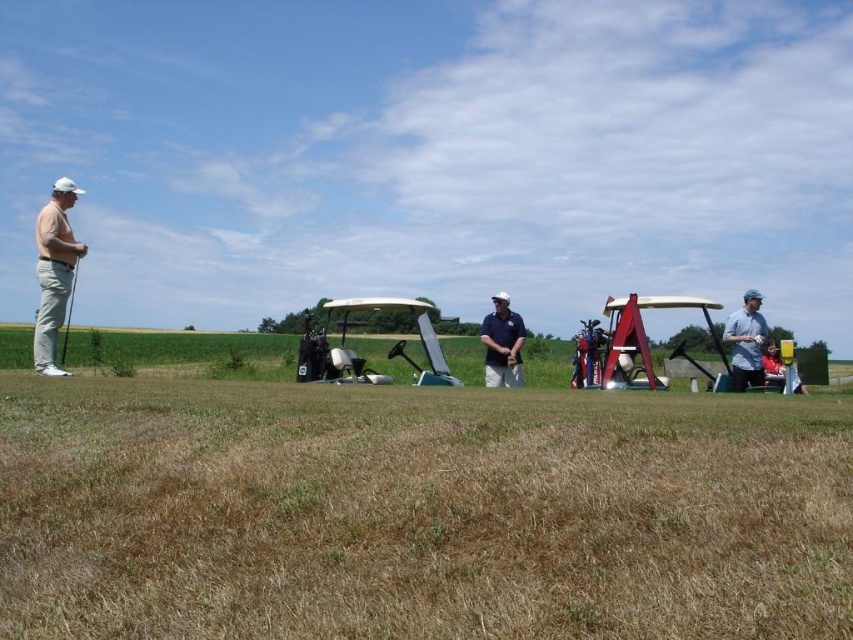
You are a photographer trying to capture a group photo of the two golfers wearing the blue cotton polo shirt at center and the red fabric shirt at right. Since you want to ensure both subjects are clearly visible, which golfer should you position closer to the camera to compensate for their actual sizes?

The blue cotton polo shirt at center is smaller in size compared to the red fabric shirt at right. To ensure both are clearly visible, position the blue cotton polo shirt at center closer to the camera so its image appears larger, balancing their sizes in the photo.

You are a golfer standing near the golf carts and want to hand a golf club to the person wearing the blue cotton polo shirt at center. Which direction should you walk to reach them compared to the red fabric shirt at right?

The blue cotton polo shirt at center is to the left of the red fabric shirt at right, so you should walk to the left side of the red fabric shirt at right to reach the blue cotton polo shirt at center.

From the picture: You are a photographer positioned at the center of the golf course. You want to capture a photo of both the blue cotton shirt at right and the red fabric shirt at right in the same frame. Which shirt should you pan your camera to the left to include in the shot?

The blue cotton shirt at right is to the left of the red fabric shirt at right. To include both in the frame, you should pan your camera to the left to capture the blue cotton shirt at right first, then adjust to include the red fabric shirt at right.